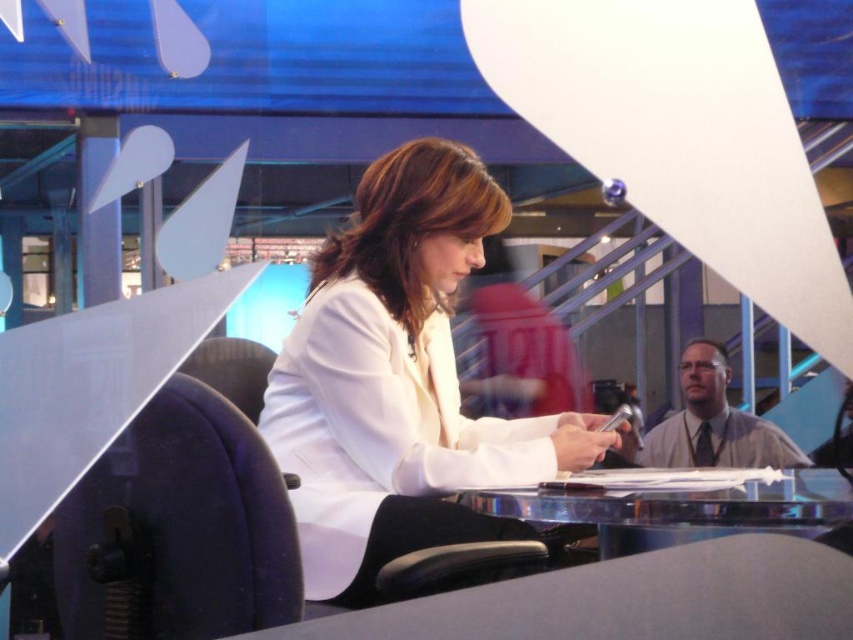
Question: Which object is closer to the camera taking this photo?

Choices:
 (A) black fabric swivel chair at left
 (B) white matte jacket at center

Answer: (A)

Question: Which point is closer to the camera?

Choices:
 (A) (311, 304)
 (B) (144, 556)

Answer: (B)

Question: Is white matte jacket at center positioned at the back of black fabric swivel chair at left?

Choices:
 (A) yes
 (B) no

Answer: (A)

Question: Which of these objects is positioned closest to the black fabric swivel chair at left?

Choices:
 (A) clear glass table at center
 (B) white matte jacket at center

Answer: (B)

Question: Is white matte jacket at center thinner than black fabric swivel chair at left?

Choices:
 (A) yes
 (B) no

Answer: (B)

Question: Where is white matte jacket at center located in relation to black fabric swivel chair at left in the image?

Choices:
 (A) left
 (B) right

Answer: (B)